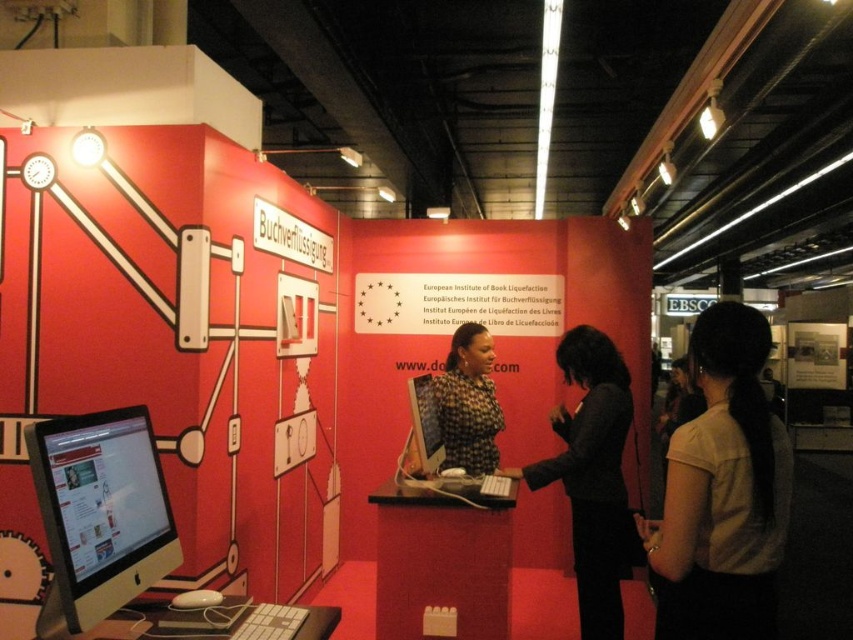
Question: Which of the following is the farthest from the observer?

Choices:
 (A) coord(440,433)
 (B) coord(486,394)
 (C) coord(595,444)
 (D) coord(737,449)

Answer: (B)

Question: Does white fabric shirt at right appear over dark brown leather jacket at center?

Choices:
 (A) no
 (B) yes

Answer: (B)

Question: Does dark brown leather jacket at center appear over matte black dress at center?

Choices:
 (A) no
 (B) yes

Answer: (A)

Question: Which point appears closest to the camera in this image?

Choices:
 (A) (438, 392)
 (B) (413, 413)
 (C) (62, 509)
 (D) (737, 573)

Answer: (C)

Question: Is white fabric shirt at right behind matte black monitor at lower left?

Choices:
 (A) no
 (B) yes

Answer: (B)

Question: Which point is farther to the camera?

Choices:
 (A) (590, 632)
 (B) (175, 564)
 (C) (416, 422)
 (D) (720, 333)

Answer: (C)